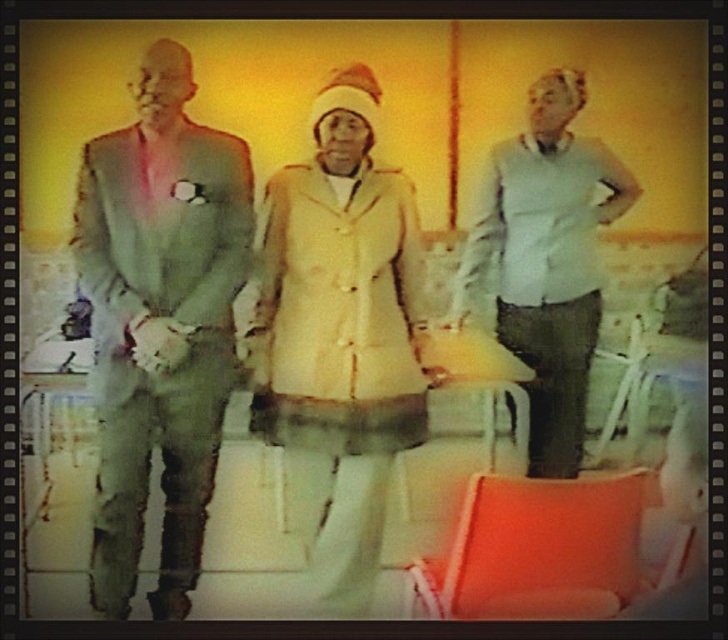
Does point (126, 131) come in front of point (521, 224)?

Yes.

Does matte gray suit at left have a larger size compared to light blue sweater at center?

No, matte gray suit at left is not bigger than light blue sweater at center.

Who is more distant from viewer, (84, 145) or (546, 250)?

Positioned behind is point (546, 250).

Locate an element on the screen. This screenshot has height=640, width=728. matte gray suit at left is located at coordinates click(159, 323).

What do you see at coordinates (159, 323) in the screenshot?
I see `matte gray suit at left` at bounding box center [159, 323].

Who is positioned more to the right, matte gray suit at left or light beige fabric coat at center?

light beige fabric coat at center is more to the right.

What are the coordinates of `matte gray suit at left` in the screenshot? It's located at (159, 323).

Can you confirm if light beige fabric coat at center is wider than light blue sweater at center?

In fact, light beige fabric coat at center might be narrower than light blue sweater at center.

Between light beige fabric coat at center and light blue sweater at center, which one appears on the left side from the viewer's perspective?

Positioned to the left is light beige fabric coat at center.

Locate an element on the screen. light beige fabric coat at center is located at coordinates (339, 337).